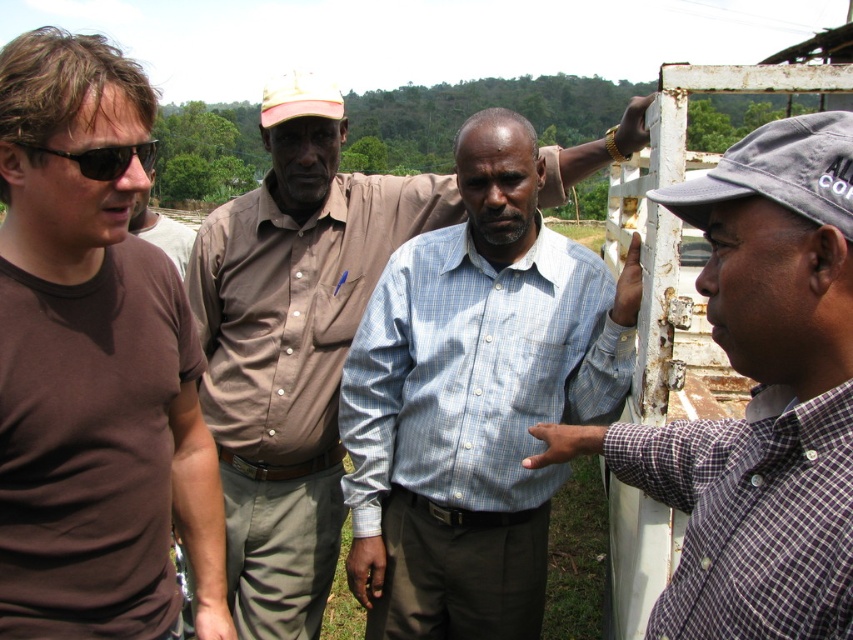
Is checkered shirt at center thinner than brown t-shirt at left?

Incorrect, checkered shirt at center's width is not less than brown t-shirt at left's.

Measure the distance between checkered shirt at center and camera.

They are 86.20 centimeters apart.

Find the location of a particular element. checkered shirt at center is located at coordinates (759, 397).

I want to click on checkered shirt at center, so click(x=759, y=397).

Does point (103, 397) come behind point (119, 161)?

Yes, it is.

Is point (163, 452) behind point (96, 177)?

Yes.

Find the location of a particular element. The width and height of the screenshot is (853, 640). brown t-shirt at left is located at coordinates (102, 273).

Between point (831, 435) and point (154, 173), which one is positioned behind?

The point (154, 173) is more distant.

Who is more forward, (717, 312) or (193, 241)?

Point (717, 312) is in front.

The image size is (853, 640). Find the location of `checkered shirt at center`. checkered shirt at center is located at coordinates (759, 397).